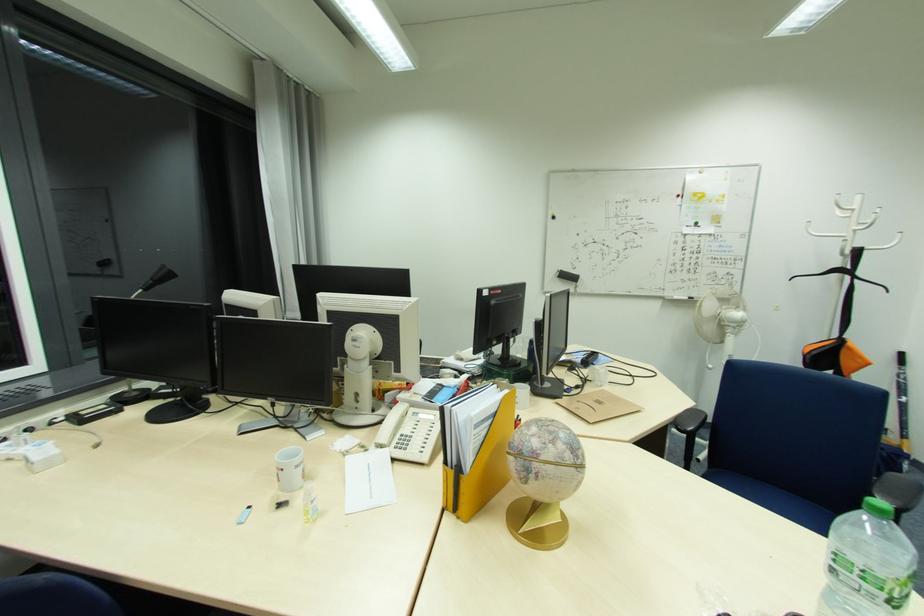
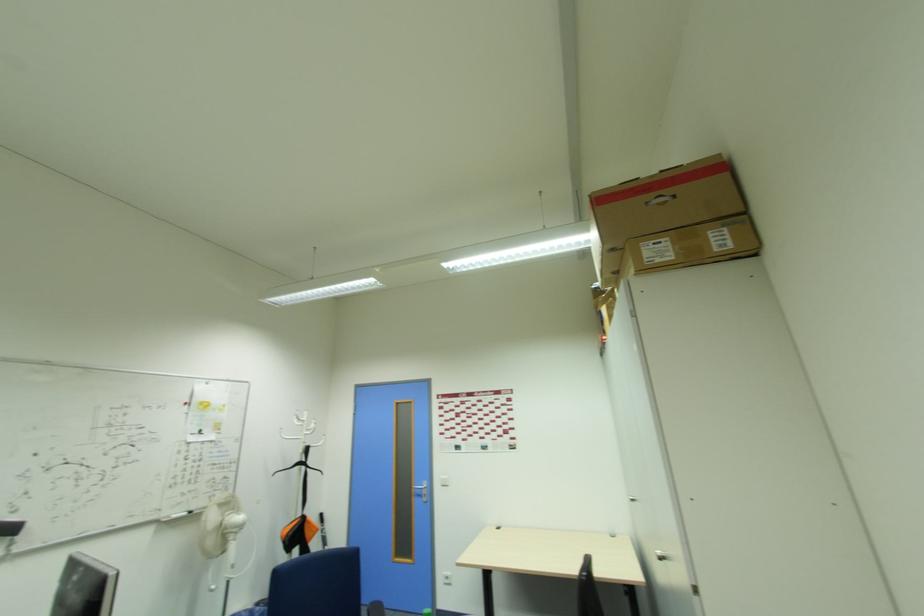
The first image is from the beginning of the video and the second image is from the end. How did the camera likely rotate when shooting the video?

The camera's rotation is toward right-up.